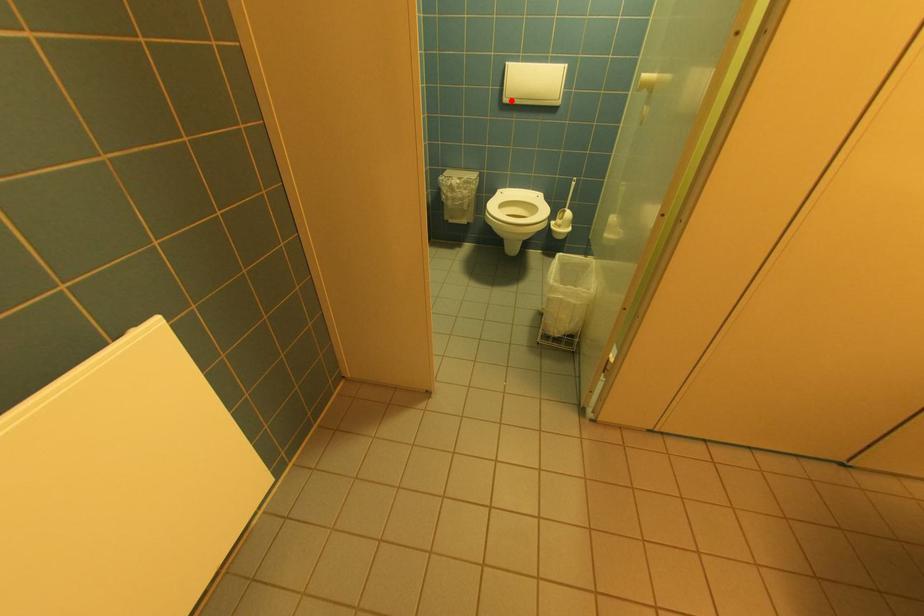
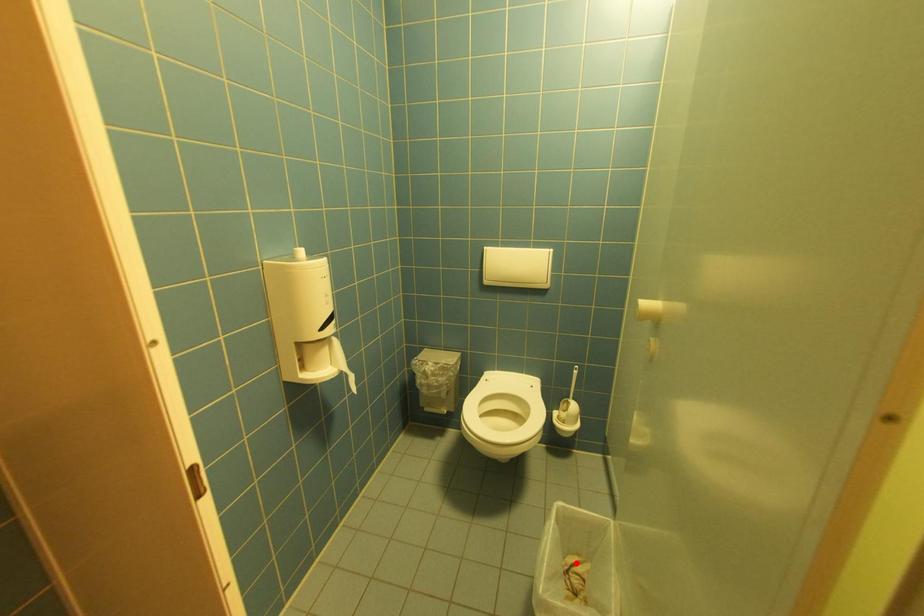
I am providing you with two images of the same scene from different viewpoints. A red point is marked on the first image and another point is marked on the second image. Do the highlighted points in image1 and image2 indicate the same real-world spot?

No